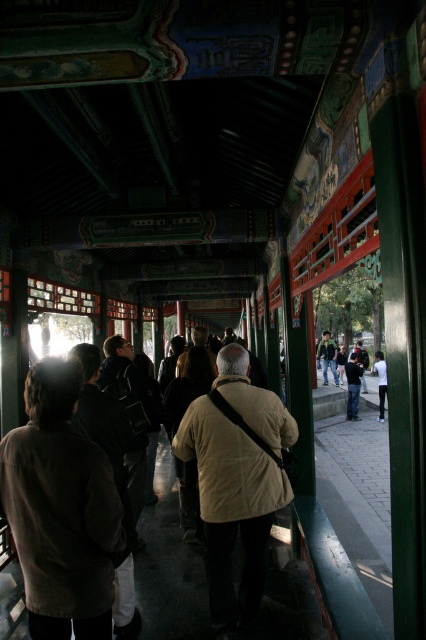
You are standing in the corridor and see two points marked on the floor. The first point is at coordinate point [377,488] and the second is at coordinate point [189,474]. Which point is closer to you?

Point [377,488] is further to the viewer than point [189,474], so the second point at [189,474] is closer to you.

You are a tour guide leading a group through the historical site. You need to walk from the entrance to the exit, which is located beyond the gray concrete pavement at lower right. However, you must carry a light beige jacket at center for a visitor. Can you pass through the corridor while holding the jacket without dropping it?

The gray concrete pavement at lower right is wider than the light beige jacket at center, so yes, you can pass through the corridor while holding the jacket without dropping it because the pavement provides enough space.

You are standing in the corridor and want to move from one point to another. Which point should you walk towards if you want to go closer to the ceiling decorations? Please choose between point A at point(340, 541) and point B at point(322, 332).

You should walk towards point A at point(340, 541) because it is closer to the viewer, and since the ceiling decorations are above, moving towards a closer point would mean being under a part of the corridor where the ceiling is nearer in perspective, allowing better access to the decorations.